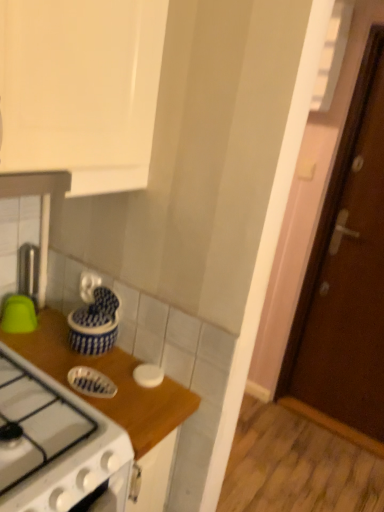
I want to click on vacant space to the left of blue glossy dish at center, the 3th kitchen appliance from the left, so click(50, 357).